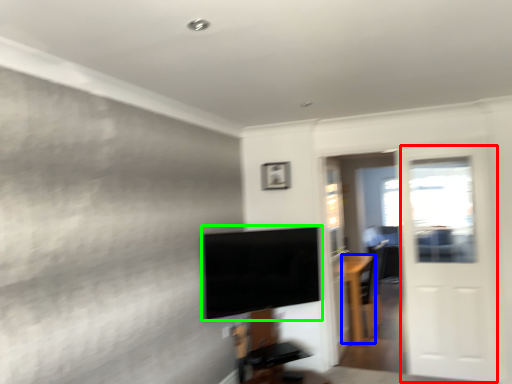
Question: Estimate the real-world distances between objects in this image. Which object is closer to screen door (highlighted by a red box), furniture (highlighted by a blue box) or television (highlighted by a green box)?

Choices:
 (A) furniture
 (B) television

Answer: (A)